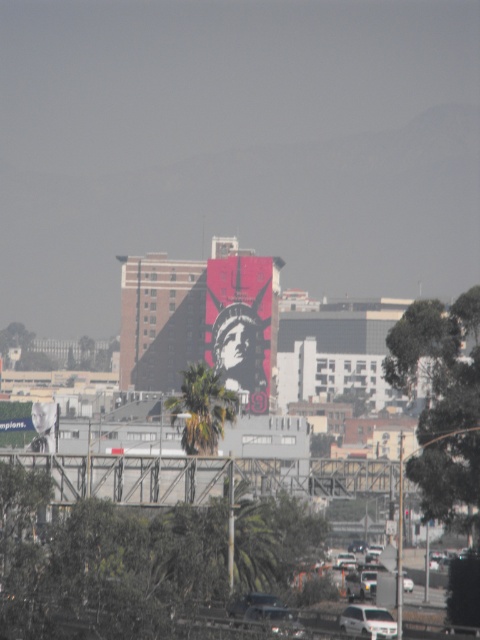
In the scene shown: You are a drone operator trying to capture aerial footage of the Statue of Liberty billboard. Your drone has a maximum flight range of 2000 feet. Based on the scene, can your drone safely reach the point marked at coordinates point (233, 291) without exceeding its range limit?

The point (233, 291) is 2057.38 feet from the camera, which exceeds the drone operator s 2000 feet maximum flight range. Therefore, the drone cannot safely reach the point without exceeding its range limit.

You are standing in the urban landscape and want to take a photo of both the stained glass statue at center and the green leafy palm tree at center. Which object should you frame first in your camera viewfinder to ensure both are in the shot?

You should frame the green leafy palm tree at center first since the stained glass statue at center is to the right of it, ensuring both are included in the viewfinder.